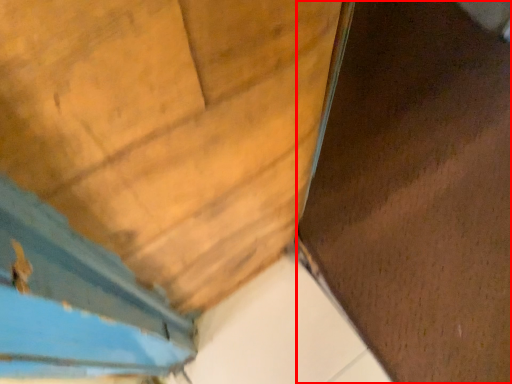
Question: From the image's perspective, what is the correct spatial relationship of plywood (annotated by the red box) in relation to door?

Choices:
 (A) above
 (B) below

Answer: (A)